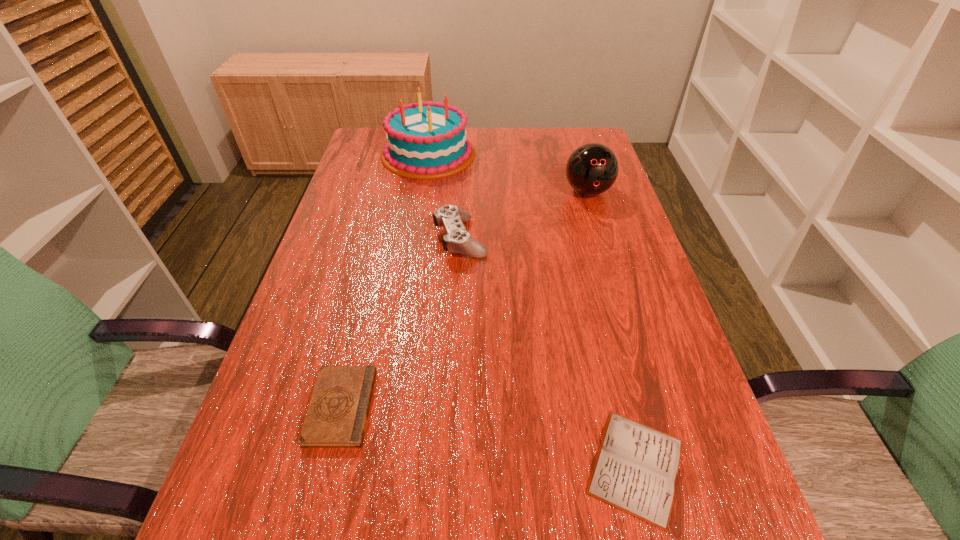
This screenshot has width=960, height=540. Identify the location of vacant space at the left edge of the desktop. (381, 226).

The image size is (960, 540). Identify the location of vacant position at the right edge of the desktop. (685, 534).

Locate an element on the screen. Image resolution: width=960 pixels, height=540 pixels. vacant space that is in between the third shortest object and the shortest object is located at coordinates (548, 352).

This screenshot has width=960, height=540. Identify the location of vacant point located between the shorter diary and the birthday cake. (532, 310).

Identify the location of free space between the fourth shortest object and the control. Image resolution: width=960 pixels, height=540 pixels. (524, 215).

Locate an element on the screen. This screenshot has height=540, width=960. vacant area that lies between the tallest object and the bowling ball is located at coordinates (508, 172).

Locate an element on the screen. This screenshot has height=540, width=960. empty space that is in between the birthday cake and the bowling ball is located at coordinates pos(508,172).

The image size is (960, 540). What are the coordinates of `free space that is in between the tallest object and the second shortest object` in the screenshot? It's located at (385, 280).

The height and width of the screenshot is (540, 960). In order to click on empty space between the tallest object and the third farthest object in this screenshot , I will do `click(444, 196)`.

Where is `free spot between the third tallest object and the tallest object`? Image resolution: width=960 pixels, height=540 pixels. free spot between the third tallest object and the tallest object is located at coordinates (444, 196).